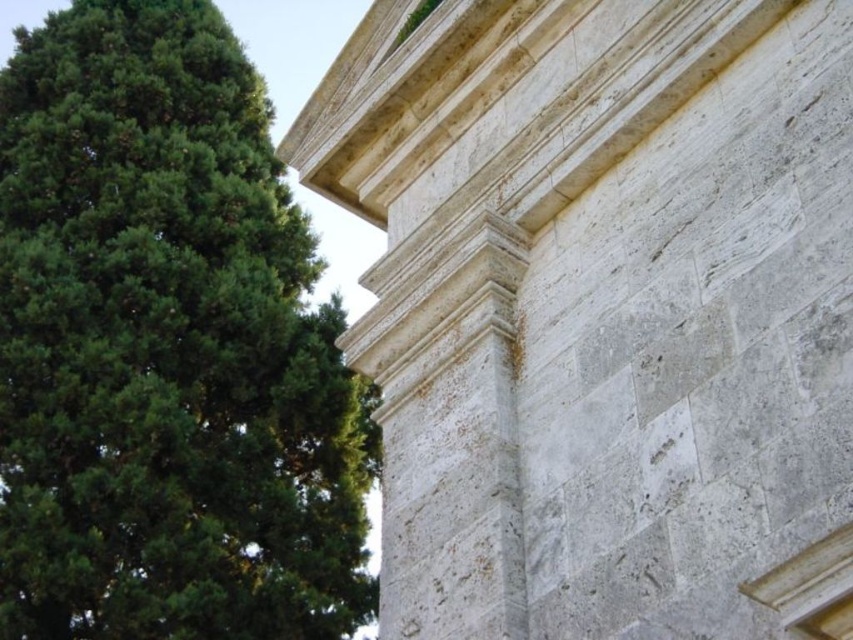
Question: Is white stone tower at upper right positioned in front of green leafy tree at upper left?

Choices:
 (A) yes
 (B) no

Answer: (A)

Question: Does white stone tower at upper right have a lesser width compared to green leafy tree at upper left?

Choices:
 (A) yes
 (B) no

Answer: (A)

Question: Can you confirm if white stone tower at upper right is positioned above green leafy tree at upper left?

Choices:
 (A) yes
 (B) no

Answer: (B)

Question: Which point is farther from the camera taking this photo?

Choices:
 (A) (248, 464)
 (B) (329, 196)

Answer: (A)

Question: Among these points, which one is nearest to the camera?

Choices:
 (A) (824, 385)
 (B) (53, 93)

Answer: (A)